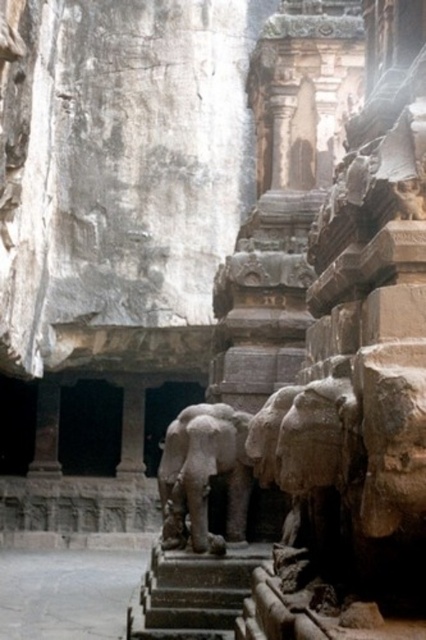
You are an archaeologist standing at the entrance of the ancient temple. You see the gray stone elephant at center. Can you estimate its location in terms of coordinates?

The gray stone elephant at center is located at coordinates point (203, 474).

You are an archaeologist examining the ancient stone structure. You notice the gray stone elephant at center and the dark gray stone stairs at center. Which object is positioned higher in elevation?

The gray stone elephant at center is located above the dark gray stone stairs at center, so it is positioned higher in elevation.

You are an archaeologist examining the ancient stone structure. You notice the gray stone elephant at center and the dark gray stone stairs at center. Which object takes up more area in the scene?

The dark gray stone stairs at center occupies more space than the gray stone elephant at center, so the stairs take up more area in the scene.